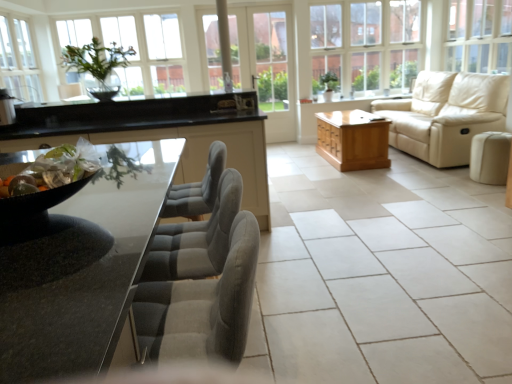
Where is `light brown wooden cabinet at center`? This screenshot has height=384, width=512. light brown wooden cabinet at center is located at coordinates (353, 139).

Measure the distance between light brown wooden cabinet at center and camera.

light brown wooden cabinet at center and camera are 4.71 meters apart.

What do you see at coordinates (20, 186) in the screenshot? I see `shiny metallic bowl at left, the first food from the front` at bounding box center [20, 186].

Image resolution: width=512 pixels, height=384 pixels. In order to click on shiny metallic bowl at left, the first food from the front in this screenshot , I will do `click(20, 186)`.

The height and width of the screenshot is (384, 512). Find the location of `beige leather couch at right`. beige leather couch at right is located at coordinates (446, 115).

Where is `clear glass window at upper right, placed as the 1th window when sorted from right to left`? The height and width of the screenshot is (384, 512). clear glass window at upper right, placed as the 1th window when sorted from right to left is located at coordinates (479, 36).

Image resolution: width=512 pixels, height=384 pixels. Find the location of `shiny metallic bowl of fruits at left, which ranks as the second food in front-to-back order`. shiny metallic bowl of fruits at left, which ranks as the second food in front-to-back order is located at coordinates (54, 169).

Who is bigger, velvet grey chair at center or clear glass window at upper right, placed as the 1th window when sorted from right to left?

clear glass window at upper right, placed as the 1th window when sorted from right to left, is bigger.

Could you tell me if velvet grey chair at center is turned towards clear glass window at upper right, placed as the 1th window when sorted from right to left?

No, velvet grey chair at center does not turn towards clear glass window at upper right, placed as the 1th window when sorted from right to left.

Which of these two, velvet grey chair at center or clear glass window at upper right, placed as the 1th window when sorted from right to left, stands taller?

With more height is clear glass window at upper right, placed as the 1th window when sorted from right to left.

Do you think velvet grey chair at center is within clear glass window at upper right, the third window from the left, or outside of it?

velvet grey chair at center is not inside clear glass window at upper right, the third window from the left, it's outside.

Is beige fabric bar stool at right in front of or behind green leafy plant at upper left in the image?

beige fabric bar stool at right is positioned farther from the viewer than green leafy plant at upper left.

Which object is thinner, beige fabric bar stool at right or green leafy plant at upper left?

green leafy plant at upper left is thinner.

From a real-world perspective, which object stands above the other?

green leafy plant at upper left, from a real-world perspective.

Which is closer to the camera, (481, 169) or (122, 65)?

Clearly, point (481, 169) is more distant from the camera than point (122, 65).

How different are the orientations of shiny metallic bowl of fruits at left, which ranks as the second food in front-to-back order, and black glossy table at left in degrees?

The facing directions of shiny metallic bowl of fruits at left, which ranks as the second food in front-to-back order, and black glossy table at left are 110 degrees apart.

Based on their positions, is shiny metallic bowl of fruits at left, which ranks as the second food in front-to-back order, located to the left or right of black glossy table at left?

Clearly, shiny metallic bowl of fruits at left, which ranks as the second food in front-to-back order, is on the right of black glossy table at left in the image.

From a real-world perspective, which is physically above, shiny metallic bowl of fruits at left, placed as the first food when sorted from back to front, or black glossy table at left?

shiny metallic bowl of fruits at left, placed as the first food when sorted from back to front, is physically above.

From the image's perspective, would you say white ceramic tile at center is positioned over green leafy plant at upper left?

No, from the image's perspective, white ceramic tile at center is not over green leafy plant at upper left.

Is white ceramic tile at center positioned with its back to green leafy plant at upper left?

No, green leafy plant at upper left is not at the back of white ceramic tile at center.

Is white ceramic tile at center not within green leafy plant at upper left?

white ceramic tile at center is positioned outside green leafy plant at upper left.

Does white ceramic tile at center lie behind green leafy plant at upper left?

No, white ceramic tile at center is closer to the camera.

Considering the relative sizes of light brown wooden cabinet at center and shiny metallic bowl at left, the 2th food positioned from the back, in the image provided, is light brown wooden cabinet at center shorter than shiny metallic bowl at left, the 2th food positioned from the back,?

Incorrect, the height of light brown wooden cabinet at center does not fall short of that of shiny metallic bowl at left, the 2th food positioned from the back.

Is light brown wooden cabinet at center not near shiny metallic bowl at left, the first food from the front?

Indeed, light brown wooden cabinet at center is not near shiny metallic bowl at left, the first food from the front.

From the image's perspective, relative to shiny metallic bowl at left, the 2th food positioned from the back, is light brown wooden cabinet at center above or below?

light brown wooden cabinet at center is above shiny metallic bowl at left, the 2th food positioned from the back.

Is light brown wooden cabinet at center surrounding shiny metallic bowl at left, the first food from the front?

No, light brown wooden cabinet at center does not contain shiny metallic bowl at left, the first food from the front.

Is beige fabric bar stool at right next to shiny metallic bowl of fruits at left, which ranks as the second food in front-to-back order, and touching it?

No, beige fabric bar stool at right is not with shiny metallic bowl of fruits at left, which ranks as the second food in front-to-back order.

Can you tell me how much beige fabric bar stool at right and shiny metallic bowl of fruits at left, which ranks as the second food in front-to-back order, differ in facing direction?

The facing directions of beige fabric bar stool at right and shiny metallic bowl of fruits at left, which ranks as the second food in front-to-back order, are 19.6 degrees apart.

Can you confirm if beige fabric bar stool at right is taller than shiny metallic bowl of fruits at left, placed as the first food when sorted from back to front?

Indeed, beige fabric bar stool at right has a greater height compared to shiny metallic bowl of fruits at left, placed as the first food when sorted from back to front.

Where is `food that is the 2nd one above the beige fabric bar stool at right (from a real-world perspective)`? The width and height of the screenshot is (512, 384). food that is the 2nd one above the beige fabric bar stool at right (from a real-world perspective) is located at coordinates (54, 169).

From the image's perspective, is beige leather couch at right positioned above or below light brown wooden cabinet at center?

beige leather couch at right is above light brown wooden cabinet at center.

Is beige leather couch at right at the left side of light brown wooden cabinet at center?

In fact, beige leather couch at right is to the right of light brown wooden cabinet at center.

Would you say beige leather couch at right contains light brown wooden cabinet at center?

No, light brown wooden cabinet at center is not surrounded by beige leather couch at right.

Identify the location of window that is the 1st object located behind the velvet grey chair at center. This screenshot has height=384, width=512. (479, 36).

Image resolution: width=512 pixels, height=384 pixels. In order to click on houseplant in front of the beige fabric bar stool at right in this screenshot , I will do `click(98, 67)`.

Based on their spatial positions, is beige fabric bar stool at right or shiny metallic bowl at left, the first food from the front, closer to beige leather couch at right?

beige fabric bar stool at right is positioned closer to the anchor beige leather couch at right.

From the image, which object appears to be farther from beige leather couch at right, shiny metallic bowl of fruits at left, placed as the first food when sorted from back to front, or granite gray table at center?

shiny metallic bowl of fruits at left, placed as the first food when sorted from back to front, lies further to beige leather couch at right than the other object.

Based on their spatial positions, is velvet grey chair at center or white ceramic tile at center further from clear glass window at upper right, the third window from the left?

velvet grey chair at center is further to clear glass window at upper right, the third window from the left.

Considering their positions, is green leafy plant at upper left positioned closer to shiny metallic bowl of fruits at left, which ranks as the second food in front-to-back order, than clear glass vase at upper center, placed as the third window when sorted from right to left?

green leafy plant at upper left is closer to shiny metallic bowl of fruits at left, which ranks as the second food in front-to-back order.

From the image, which object appears to be farther from beige fabric bar stool at right, white ceramic tile at center or clear glass window at upper center, the second window positioned from the right?

Among the two, clear glass window at upper center, the second window positioned from the right, is located further to beige fabric bar stool at right.

Consider the image. When comparing their distances from green leafy plant at upper left, does velvet grey chair at center or clear glass window at upper center, the second window positioned from the right, seem further?

The object further to green leafy plant at upper left is clear glass window at upper center, the second window positioned from the right.

Which object lies nearer to the anchor point shiny metallic bowl of fruits at left, placed as the first food when sorted from back to front, beige leather couch at right or green leafy plant at upper left?

green leafy plant at upper left is positioned closer to the anchor shiny metallic bowl of fruits at left, placed as the first food when sorted from back to front.

Looking at this image, considering their positions, is granite gray table at center positioned closer to light brown wooden cabinet at center than clear glass screen door at center?

clear glass screen door at center.

At what (x,y) coordinates should I click in order to perform the action: click on ceramic tile positioned between granite gray table at center and beige fabric bar stool at right from near to far. Please return your answer as a coordinate pair (x, y). This screenshot has width=512, height=384. Looking at the image, I should click on (381, 275).

Find the location of a particular element. table between green leafy plant at upper left and beige fabric bar stool at right in the horizontal direction is located at coordinates (353, 139).

Locate an element on the screen. food between shiny metallic bowl at left, the 2th food positioned from the back, and light brown wooden cabinet at center in the front-back direction is located at coordinates (54, 169).

You are a GUI agent. You are given a task and a screenshot of the screen. Output one action in this format:
    pyautogui.click(x=<x>, y=<y>)
    Task: Click on the window positioned between granite gray table at center and clear glass vase at upper center, placed as the third window when sorted from right to left, from near to far
    Image resolution: width=512 pixels, height=384 pixels.
    Given the screenshot: What is the action you would take?
    pyautogui.click(x=479, y=36)